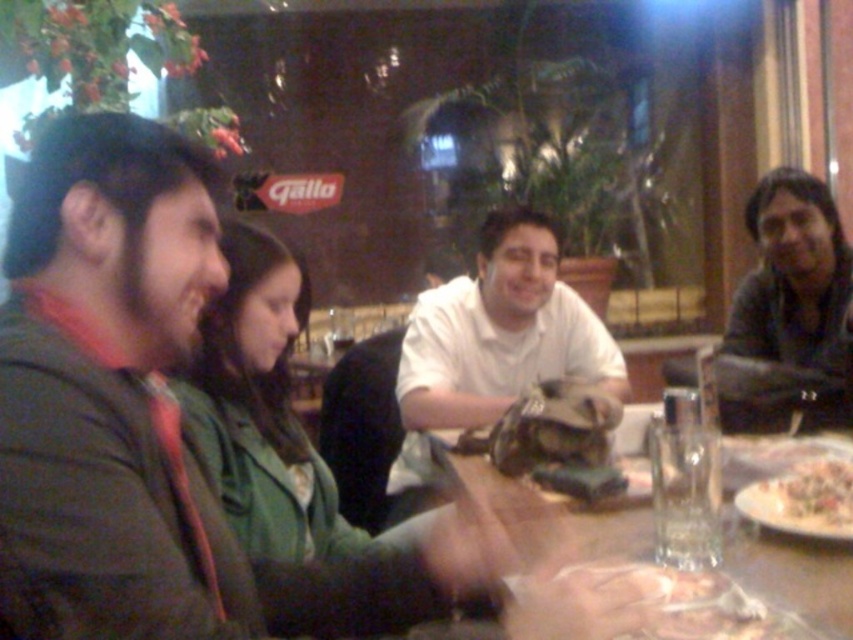
Is point (488, 298) less distant than point (804, 612)?

No, (488, 298) is further to viewer.

Does white matte shirt at center have a larger size compared to transparent glass at center?

Yes, white matte shirt at center is bigger than transparent glass at center.

Describe the element at coordinates (500, 332) in the screenshot. I see `white matte shirt at center` at that location.

Where is `white matte shirt at center`? The image size is (853, 640). white matte shirt at center is located at coordinates click(500, 332).

Who is shorter, white matte shirt at center or white creamy pasta at lower right?

white creamy pasta at lower right

Who is more distant from viewer, (520, 298) or (813, 461)?

The point (520, 298) is more distant.

The height and width of the screenshot is (640, 853). What are the coordinates of `white matte shirt at center` in the screenshot? It's located at (500, 332).

Does white matte shirt at center come in front of translucent plastic bag at lower center?

No.

Identify the location of white matte shirt at center. The image size is (853, 640). click(500, 332).

Which is in front, point (517, 332) or point (618, 576)?

Point (618, 576)

Locate an element on the screen. The image size is (853, 640). white matte shirt at center is located at coordinates (500, 332).